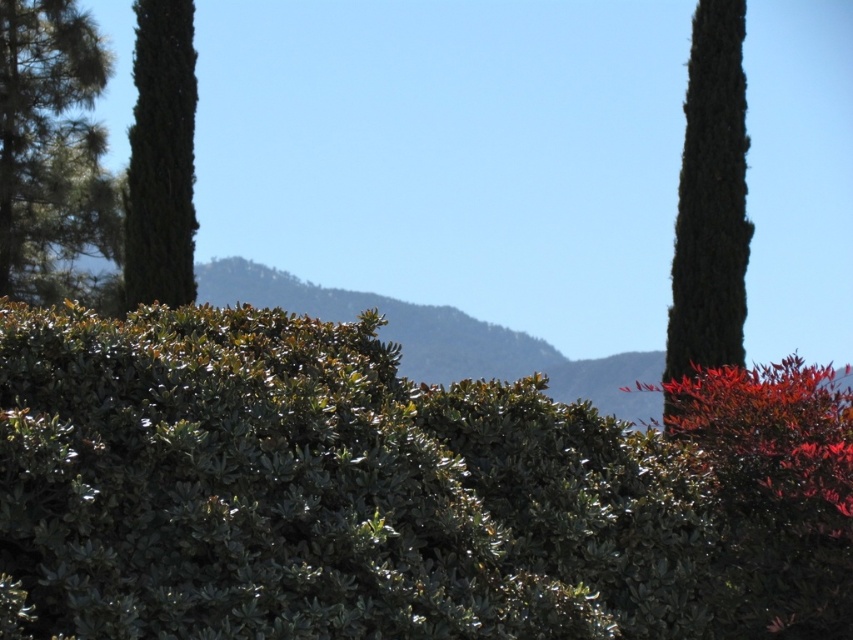
You are standing in the natural landscape described. There is a point at coordinates (51,150). What object is located at that point?

The point at coordinates (51,150) is occupied by the green leafy tree at left.

You are standing at the origin point of the image. Which of the two points, point (86,84) or point (169,154), is closer to you?

Point (169,154) is closer to you because it is in front of point (86,84).